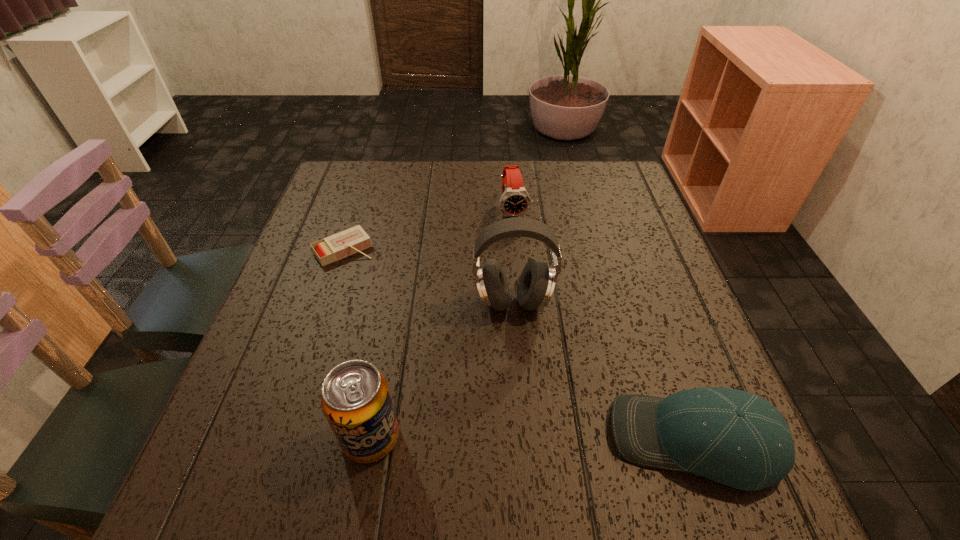
Locate an element on the screen. vacant spot on the desktop that is between the second object from left to right and the second shortest object and is positioned on the striking surface of the leftmost object is located at coordinates (487, 438).

I want to click on vacant space on the desktop that is between the fourth shortest object and the fourth tallest object and is positioned on the face of the third tallest object, so click(573, 440).

This screenshot has height=540, width=960. In order to click on free space on the desktop that is between the soda can and the baseball cap and is positioned on the ear cups of the tallest object in this screenshot , I will do `click(510, 438)`.